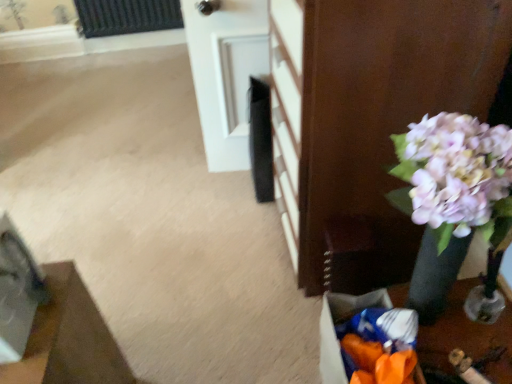
Question: Considering the relative positions of white glossy door at upper center and orange plastic bag at lower right in the image provided, is white glossy door at upper center to the left or to the right of orange plastic bag at lower right?

Choices:
 (A) right
 (B) left

Answer: (B)

Question: Considering the positions of white glossy door at upper center and orange plastic bag at lower right in the image, is white glossy door at upper center wider or thinner than orange plastic bag at lower right?

Choices:
 (A) thin
 (B) wide

Answer: (B)

Question: Which object is positioned farthest from the wooden floor mat at lower left, arranged as the 1th furniture when viewed from the left?

Choices:
 (A) matte black vase at right, which appears as the first furniture when viewed from the right
 (B) white glossy door at upper center
 (C) orange plastic bag at lower right

Answer: (B)

Question: Which object is positioned closest to the matte black vase at right, marked as the 2th furniture in a left-to-right arrangement?

Choices:
 (A) orange plastic bag at lower right
 (B) white glossy door at upper center
 (C) wooden floor mat at lower left, arranged as the 1th furniture when viewed from the left

Answer: (A)